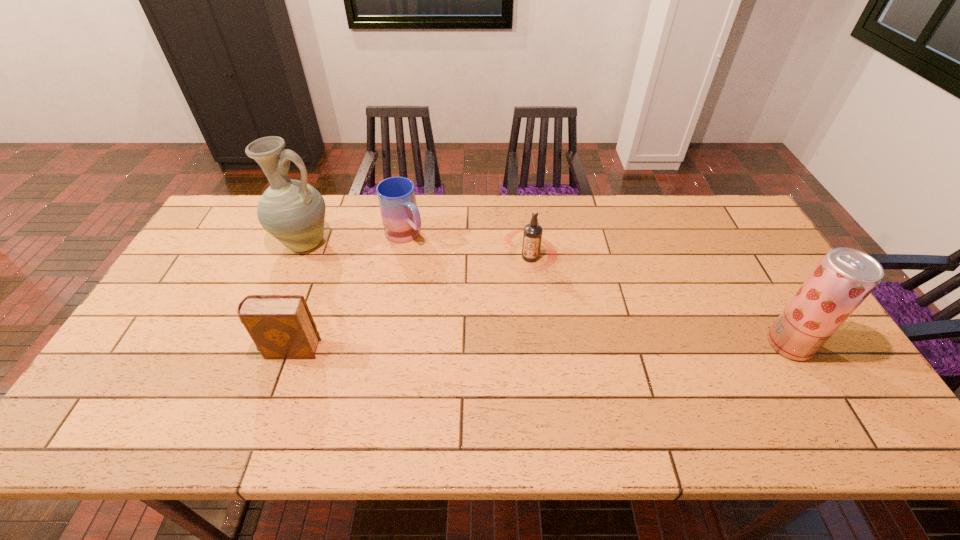
I want to click on free spot between the tallest object and the second tallest object, so click(546, 294).

The width and height of the screenshot is (960, 540). Identify the location of empty space that is in between the fruit juice and the pitcher. (546, 294).

Where is `free area in between the tallest object and the fourth shortest object`? The height and width of the screenshot is (540, 960). free area in between the tallest object and the fourth shortest object is located at coordinates (546, 294).

This screenshot has width=960, height=540. Identify the location of empty space that is in between the diary and the fruit juice. (540, 347).

Locate an element on the screen. The image size is (960, 540). vacant region between the root beer and the diary is located at coordinates (411, 303).

Identify the location of free point between the mug and the fruit juice. This screenshot has width=960, height=540. (597, 290).

In order to click on free spot between the diary and the second tallest object in this screenshot , I will do `click(540, 347)`.

Identify which object is the second nearest to the root beer. Please provide its 2D coordinates. Your answer should be formatted as a tuple, i.e. [(x, y)], where the tuple contains the x and y coordinates of a point satisfying the conditions above.

[(292, 211)]

Identify which object is the closest to the pitcher. Please provide its 2D coordinates. Your answer should be formatted as a tuple, i.e. [(x, y)], where the tuple contains the x and y coordinates of a point satisfying the conditions above.

[(400, 216)]

I want to click on free spot that satisfies the following two spatial constraints: 1. on the front side of the mug; 2. on the left side of the fourth object from left to right, so click(401, 257).